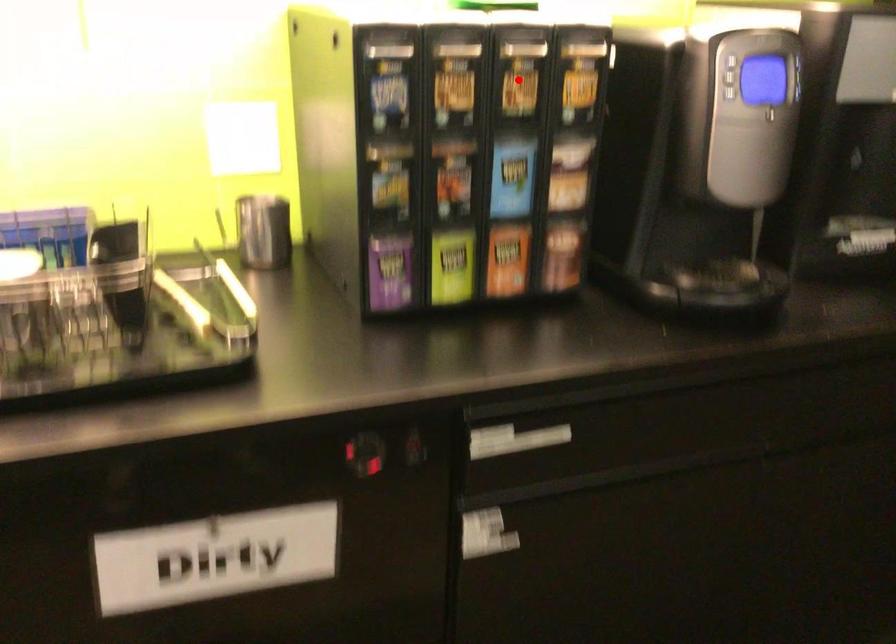
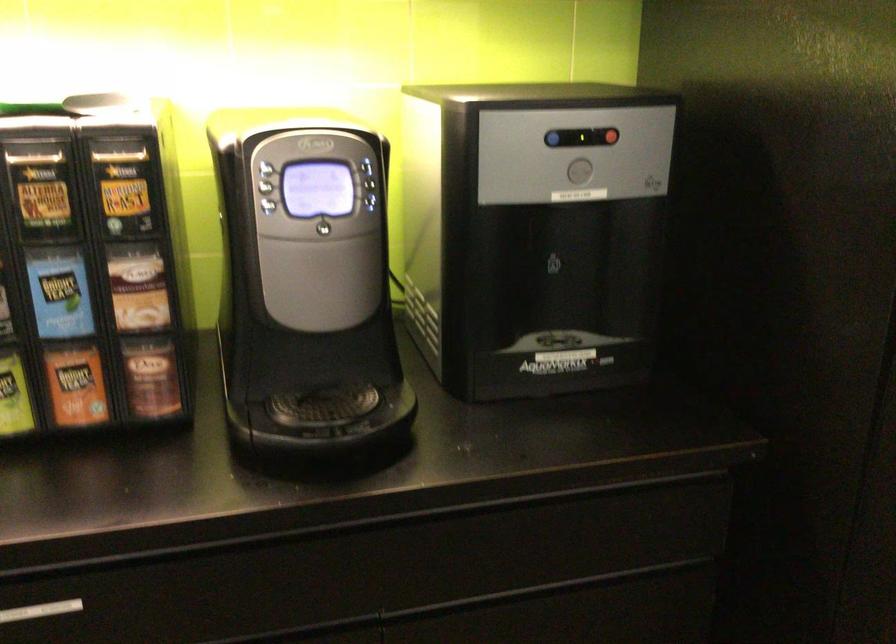
Find the pixel in the second image that matches the highlighted location in the first image.

(41, 191)